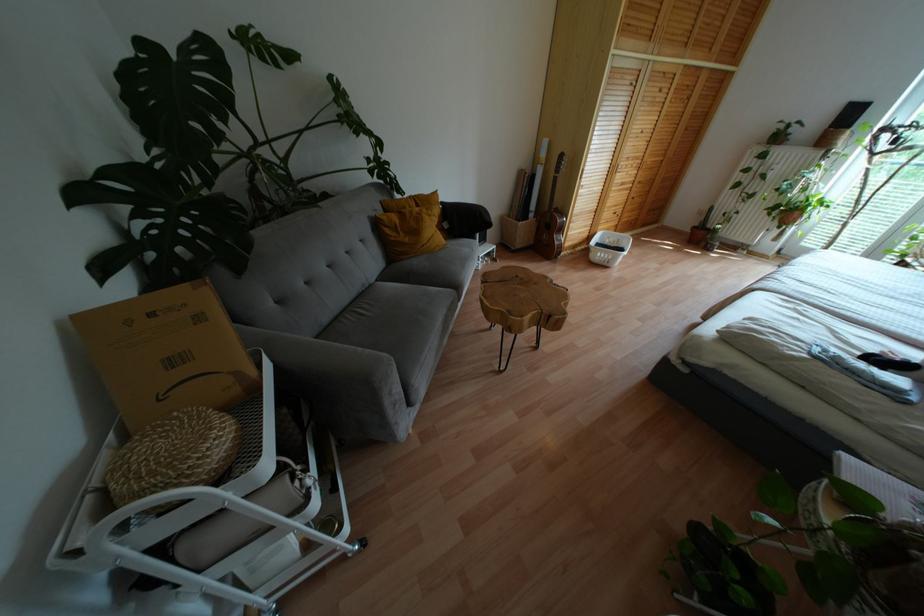
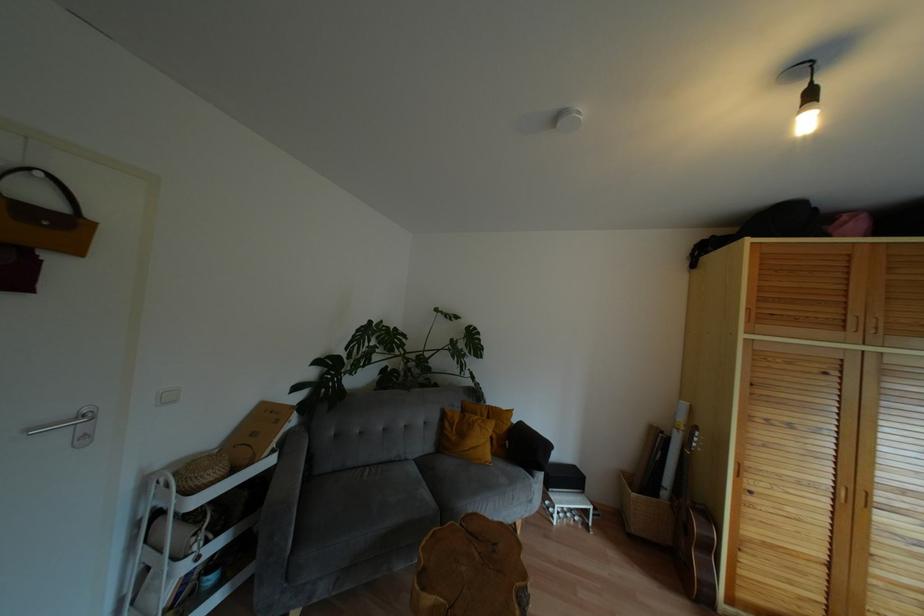
The point at (434, 193) is marked in the first image. Where is the corresponding point in the second image?

(508, 411)